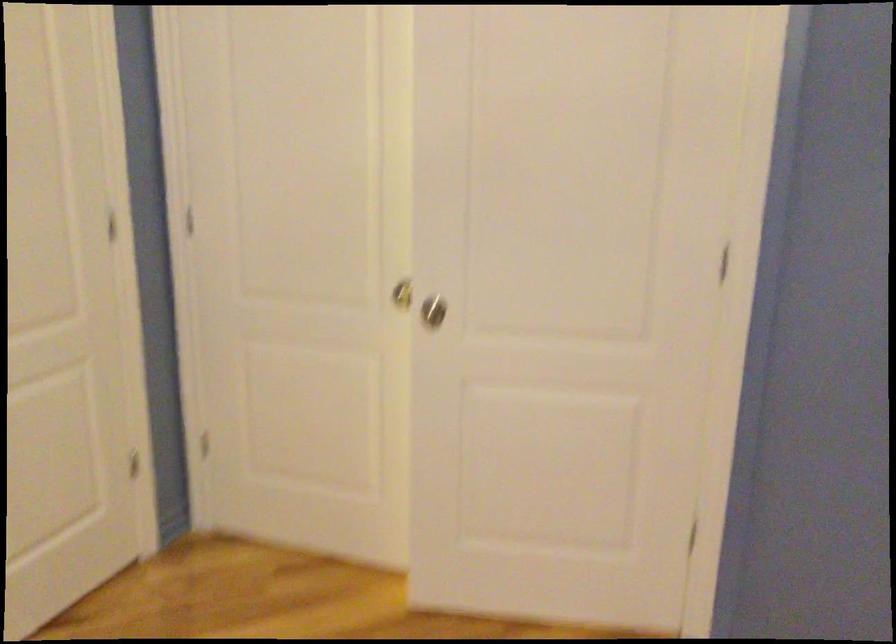
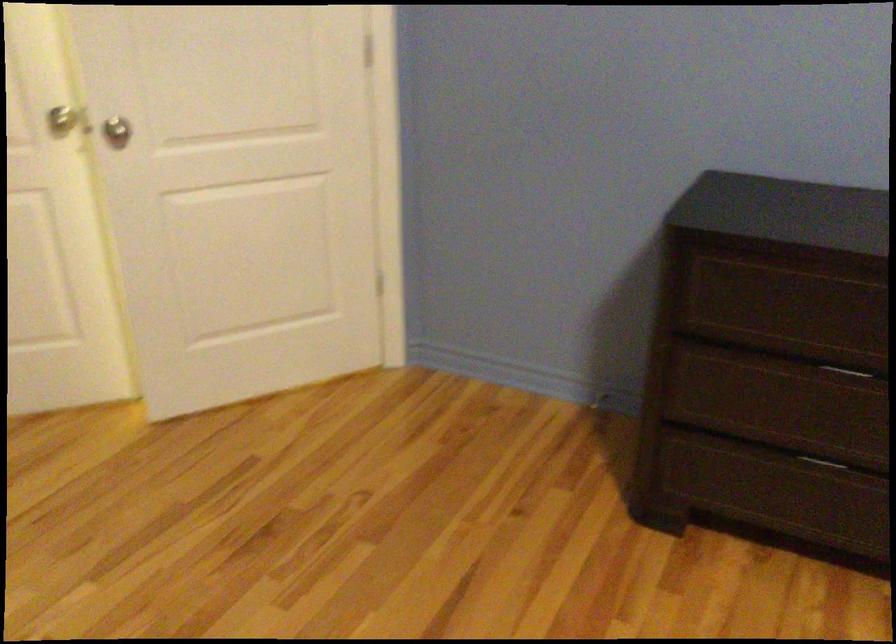
Find the pixel in the second image that matches point 438,317 in the first image.

(116, 131)